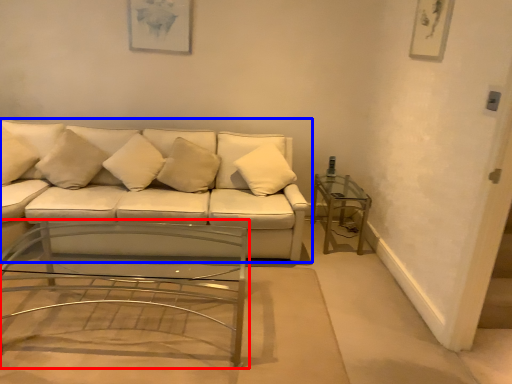
Question: Which object appears farthest to the camera in this image, coffee table (highlighted by a red box) or studio couch (highlighted by a blue box)?

Choices:
 (A) coffee table
 (B) studio couch

Answer: (B)